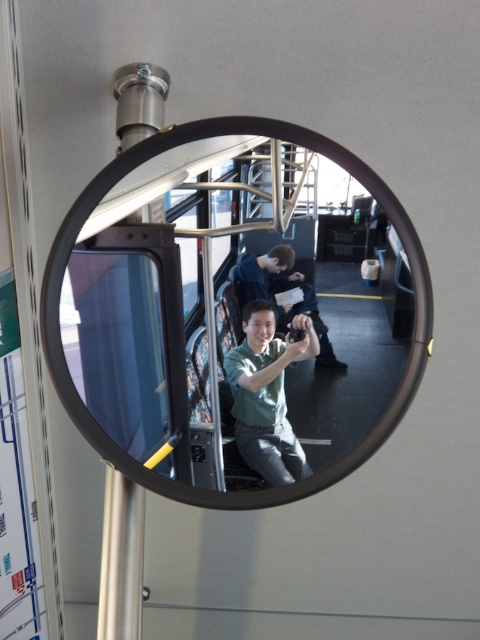
Is black reflective mirror at center to the left of matte green shirt at center from the viewer's perspective?

Correct, you'll find black reflective mirror at center to the left of matte green shirt at center.

Does black reflective mirror at center lie behind matte green shirt at center?

No, it is not.

Between point (72, 237) and point (271, 294), which one is positioned in front?

Point (72, 237) is in front.

The width and height of the screenshot is (480, 640). I want to click on black reflective mirror at center, so click(x=229, y=321).

Who is positioned more to the left, green matte shirt at center or matte green shirt at center?

From the viewer's perspective, green matte shirt at center appears more on the left side.

Who is more forward, (303, 316) or (255, 268)?

Point (303, 316) is in front.

What do you see at coordinates (266, 392) in the screenshot? I see `green matte shirt at center` at bounding box center [266, 392].

Where is `green matte shirt at center`? This screenshot has height=640, width=480. green matte shirt at center is located at coordinates (266, 392).

Who is lower down, black reflective mirror at center or transparent glass window at center?

transparent glass window at center is lower down.

Which is in front, point (79, 268) or point (95, 332)?

Positioned in front is point (79, 268).

This screenshot has height=640, width=480. What are the coordinates of `black reflective mirror at center` in the screenshot? It's located at (229, 321).